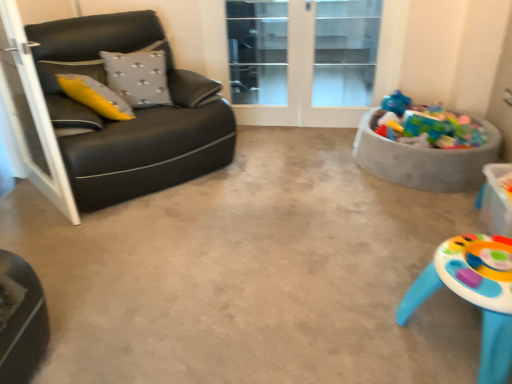
Describe the element at coordinates (138, 77) in the screenshot. I see `gray dotted pillow at upper left` at that location.

What do you see at coordinates (258, 52) in the screenshot?
I see `transparent glass screen door at upper center, placed as the 1th screen door when sorted from back to front` at bounding box center [258, 52].

What is the approximate height of matte plastic table at lower right?

matte plastic table at lower right is 15.30 inches tall.

This screenshot has width=512, height=384. What do you see at coordinates (423, 159) in the screenshot? I see `plastic colorful toys at right` at bounding box center [423, 159].

What is the approximate width of transparent glass door at center?

7.11 inches.

The image size is (512, 384). I want to click on transparent glass cabinet at upper center, so click(x=345, y=52).

Where is `gray dotted pillow at upper left`? Image resolution: width=512 pixels, height=384 pixels. gray dotted pillow at upper left is located at coordinates (138, 77).

Is transparent glass cabinet at upper center positioned beyond the bounds of transparent glass door at center?

Actually, transparent glass cabinet at upper center is within transparent glass door at center.

Considering the sizes of objects transparent glass cabinet at upper center and transparent glass door at center in the image provided, who is bigger, transparent glass cabinet at upper center or transparent glass door at center?

transparent glass door at center.

Which object is further away from the camera taking this photo, transparent glass cabinet at upper center or transparent glass door at center?

transparent glass cabinet at upper center.

From a real-world perspective, is transparent glass cabinet at upper center positioned above or below transparent glass door at center?

transparent glass cabinet at upper center is situated higher than transparent glass door at center in the real world.

Is matte plastic table at lower right oriented away from transparent glass cabinet at upper center?

No, transparent glass cabinet at upper center is not at the back of matte plastic table at lower right.

Can you see matte plastic table at lower right touching transparent glass cabinet at upper center?

matte plastic table at lower right and transparent glass cabinet at upper center are clearly separated.

Is matte plastic table at lower right to the right of transparent glass cabinet at upper center from the viewer's perspective?

Yes, matte plastic table at lower right is to the right of transparent glass cabinet at upper center.

Between transparent glass cabinet at upper center and transparent glass screen door at upper center, which ranks as the first screen door in right-to-left order, which one appears on the right side from the viewer's perspective?

Positioned to the right is transparent glass cabinet at upper center.

Is transparent glass cabinet at upper center facing towards transparent glass screen door at upper center, the second screen door when ordered from front to back?

No, transparent glass cabinet at upper center is not turned towards transparent glass screen door at upper center, the second screen door when ordered from front to back.

Consider the image. Considering the relative sizes of transparent glass cabinet at upper center and transparent glass screen door at upper center, which ranks as the first screen door in right-to-left order, in the image provided, is transparent glass cabinet at upper center shorter than transparent glass screen door at upper center, which ranks as the first screen door in right-to-left order,?

Yes.

The width and height of the screenshot is (512, 384). What are the coordinates of `window that is below the transparent glass screen door at upper center, the second screen door when ordered from front to back (from the image's perspective)` in the screenshot? It's located at (345, 52).

You are a GUI agent. You are given a task and a screenshot of the screen. Output one action in this format:
    pyautogui.click(x=<x>, y=<y>)
    Task: Click on the window above the matte plastic table at lower right (from the image's perspective)
    This screenshot has height=384, width=512.
    Given the screenshot: What is the action you would take?
    pyautogui.click(x=345, y=52)

Which of these two, transparent glass cabinet at upper center or matte plastic table at lower right, is smaller?

With smaller size is transparent glass cabinet at upper center.

Does transparent glass cabinet at upper center appear on the right side of matte plastic table at lower right?

In fact, transparent glass cabinet at upper center is to the left of matte plastic table at lower right.

Can you confirm if matte plastic table at lower right is positioned to the right of transparent glass door at center?

Yes.

You are a GUI agent. You are given a task and a screenshot of the screen. Output one action in this format:
    pyautogui.click(x=<x>, y=<y>)
    Task: Click on the glass door positioned vertically above the matte plastic table at lower right (from a real-world perspective)
    This screenshot has height=384, width=512.
    Given the screenshot: What is the action you would take?
    pos(303,61)

Which is closer, (443, 243) or (332, 44)?

Point (443, 243) appears to be closer to the viewer than point (332, 44).

Consider the image. Is matte plastic table at lower right taller than transparent glass door at center?

Incorrect, the height of matte plastic table at lower right is not larger of that of transparent glass door at center.

Is matte plastic table at lower right positioned behind black leather couch at left, placed as the first screen door when sorted from left to right?

No, matte plastic table at lower right is in front of black leather couch at left, placed as the first screen door when sorted from left to right.

Which is more to the right, matte plastic table at lower right or black leather couch at left, which ranks as the 1th screen door in front-to-back order?

Positioned to the right is matte plastic table at lower right.

Considering the relative sizes of matte plastic table at lower right and black leather couch at left, acting as the 2th screen door starting from the right, in the image provided, is matte plastic table at lower right taller than black leather couch at left, acting as the 2th screen door starting from the right,?

Incorrect, the height of matte plastic table at lower right is not larger of that of black leather couch at left, acting as the 2th screen door starting from the right.

What's the angular difference between matte plastic table at lower right and black leather couch at left, placed as the first screen door when sorted from left to right,'s facing directions?

They differ by 129 degrees in their facing directions.

Based on their sizes in the image, would you say transparent glass cabinet at upper center is bigger or smaller than plastic colorful toys at right?

Considering their sizes, transparent glass cabinet at upper center takes up less space than plastic colorful toys at right.

Considering the sizes of transparent glass cabinet at upper center and plastic colorful toys at right in the image, is transparent glass cabinet at upper center taller or shorter than plastic colorful toys at right?

transparent glass cabinet at upper center is taller than plastic colorful toys at right.

From a real-world perspective, is transparent glass cabinet at upper center positioned over plastic colorful toys at right based on gravity?

Yes, from a real-world perspective, transparent glass cabinet at upper center is over plastic colorful toys at right

The height and width of the screenshot is (384, 512). Find the location of `glass door on the left side of transparent glass cabinet at upper center`. glass door on the left side of transparent glass cabinet at upper center is located at coordinates (303, 61).

This screenshot has width=512, height=384. I want to click on table on the right of transparent glass cabinet at upper center, so pos(473,293).

Estimate the real-world distances between objects in this image. Which object is further from transparent glass screen door at upper center, the second screen door when ordered from front to back, transparent glass door at center or transparent glass cabinet at upper center?

transparent glass cabinet at upper center lies further to transparent glass screen door at upper center, the second screen door when ordered from front to back, than the other object.

Which object lies further to the anchor point gray dotted pillow at upper left, transparent glass cabinet at upper center or matte plastic table at lower right?

Based on the image, transparent glass cabinet at upper center appears to be further to gray dotted pillow at upper left.

Which object lies further to the anchor point plastic colorful toys at right, gray dotted pillow at upper left or transparent glass door at center?

The object further to plastic colorful toys at right is gray dotted pillow at upper left.

Estimate the real-world distances between objects in this image. Which object is further from plastic colorful toys at right, black leather couch at left, which ranks as the 1th screen door in front-to-back order, or black leather couch at left?

black leather couch at left, which ranks as the 1th screen door in front-to-back order, is positioned further to the anchor plastic colorful toys at right.

Based on their spatial positions, is transparent glass screen door at upper center, which ranks as the first screen door in right-to-left order, or matte plastic table at lower right further from transparent glass door at center?

Among the two, matte plastic table at lower right is located further to transparent glass door at center.

From the image, which object appears to be farther from transparent glass door at center, black leather couch at left or gray dotted pillow at upper left?

Among the two, black leather couch at left is located further to transparent glass door at center.

Estimate the real-world distances between objects in this image. Which object is closer to transparent glass door at center, gray dotted pillow at upper left or transparent glass screen door at upper center, which is the 2th screen door from left to right?

Based on the image, transparent glass screen door at upper center, which is the 2th screen door from left to right, appears to be nearer to transparent glass door at center.

Considering their positions, is plastic colorful toys at right positioned further to gray dotted pillow at upper left than transparent glass screen door at upper center, which ranks as the first screen door in right-to-left order?

plastic colorful toys at right is positioned further to the anchor gray dotted pillow at upper left.

This screenshot has width=512, height=384. In order to click on pillow between black leather couch at left and plastic colorful toys at right from left to right in this screenshot , I will do (x=138, y=77).

Where is `glass door between black leather couch at left and transparent glass screen door at upper center, which is the 2th screen door from left to right, from front to back`? The image size is (512, 384). glass door between black leather couch at left and transparent glass screen door at upper center, which is the 2th screen door from left to right, from front to back is located at coordinates (303, 61).

The width and height of the screenshot is (512, 384). Find the location of `glass door between transparent glass screen door at upper center, which is the 2th screen door from left to right, and plastic colorful toys at right from left to right`. glass door between transparent glass screen door at upper center, which is the 2th screen door from left to right, and plastic colorful toys at right from left to right is located at coordinates (303, 61).

This screenshot has height=384, width=512. I want to click on pillow between matte plastic table at lower right and transparent glass screen door at upper center, which ranks as the first screen door in right-to-left order, from front to back, so click(138, 77).